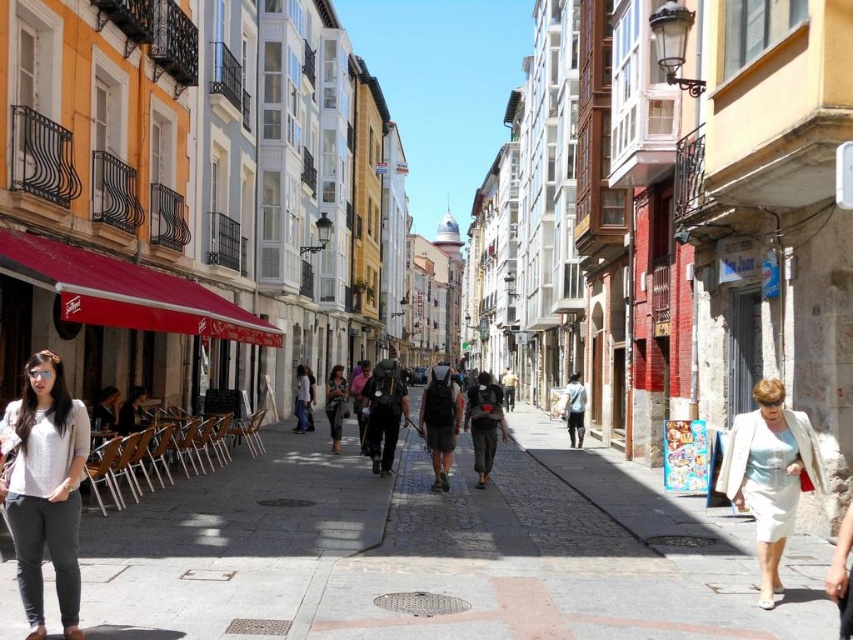
You are a fashion designer observing a street scene. You notice two garments displayed in a shop window. The light gray cotton pants at lower left and the white satin skirt at lower right. Which garment is positioned closer to the left side of the shop window?

The light gray cotton pants at lower left is positioned closer to the left side of the shop window than the white satin skirt at lower right.

You are standing on the smooth concrete sidewalk at center. What are the coordinates of your current position?

The coordinates of your current position are at point (438, 552).